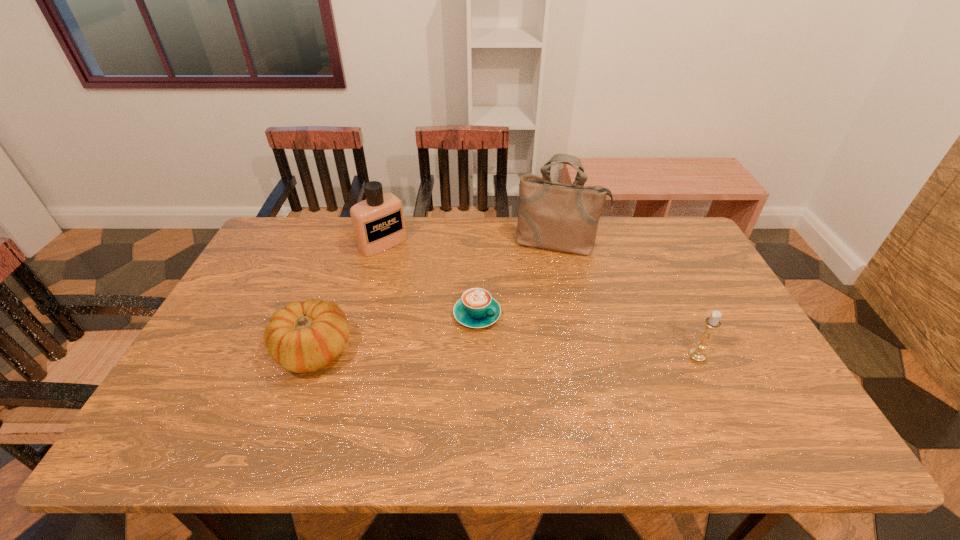
Image resolution: width=960 pixels, height=540 pixels. I want to click on free space between the tallest object and the second tallest object, so click(x=470, y=244).

This screenshot has height=540, width=960. What are the coordinates of `vacant area that lies between the third tallest object and the cappuccino` in the screenshot? It's located at (588, 335).

Identify the location of free space that is in between the third shortest object and the tallest object. (628, 300).

Where is `free spot between the perfume and the cappuccino`? free spot between the perfume and the cappuccino is located at coordinates (430, 279).

Identify the location of vacant space that's between the gourd and the perfume. (348, 298).

Locate an element on the screen. blank region between the gourd and the tallest object is located at coordinates (436, 297).

Where is `vacant area that lies between the third shortest object and the cappuccino`? vacant area that lies between the third shortest object and the cappuccino is located at coordinates (588, 335).

Locate an element on the screen. The image size is (960, 540). vacant space that's between the shoulder bag and the third object from right to left is located at coordinates (518, 279).

Locate an element on the screen. The height and width of the screenshot is (540, 960). object that is the nearest to the third object from right to left is located at coordinates (562, 217).

Image resolution: width=960 pixels, height=540 pixels. I want to click on object that is the third closest one to the second tallest object, so click(562, 217).